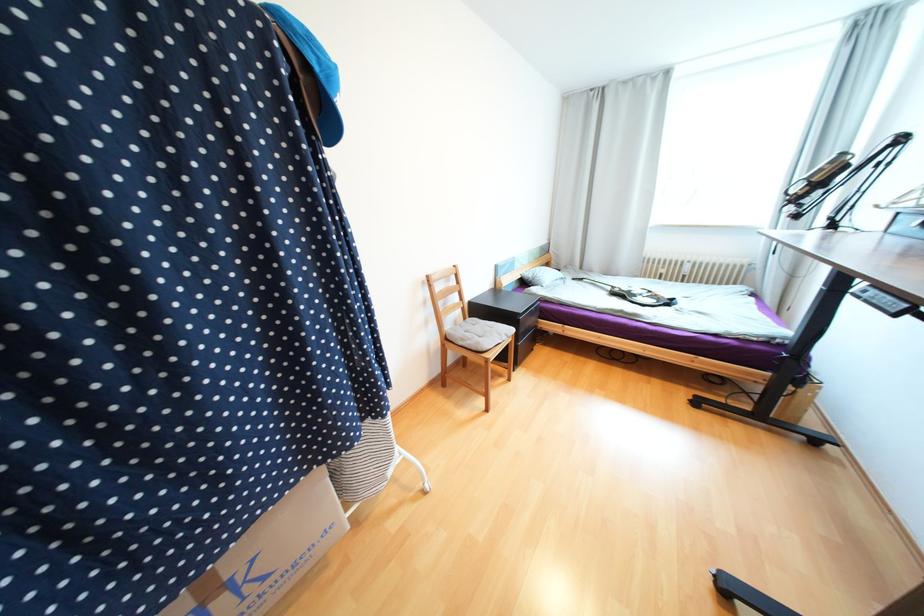
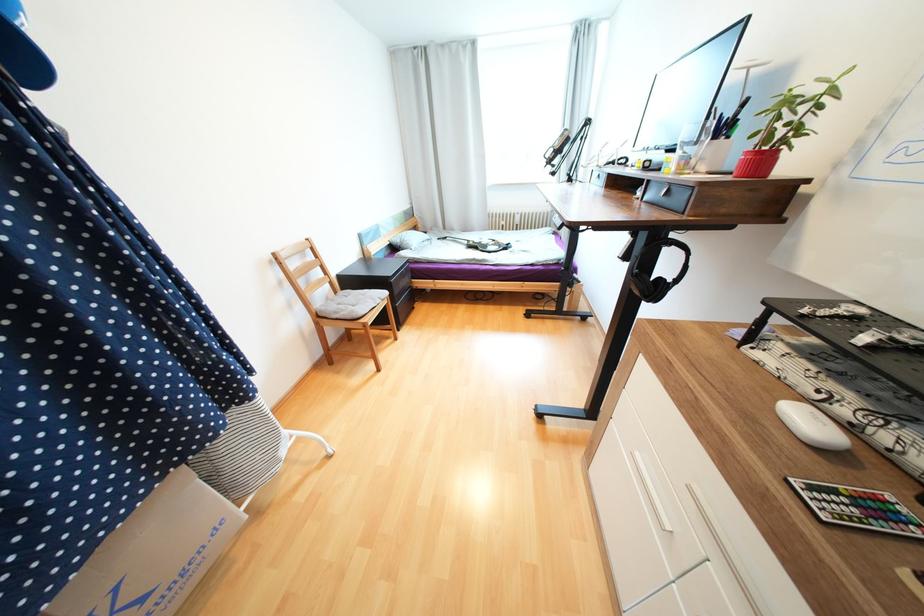
The point at (505,334) is marked in the first image. Where is the corresponding point in the second image?

(379, 300)